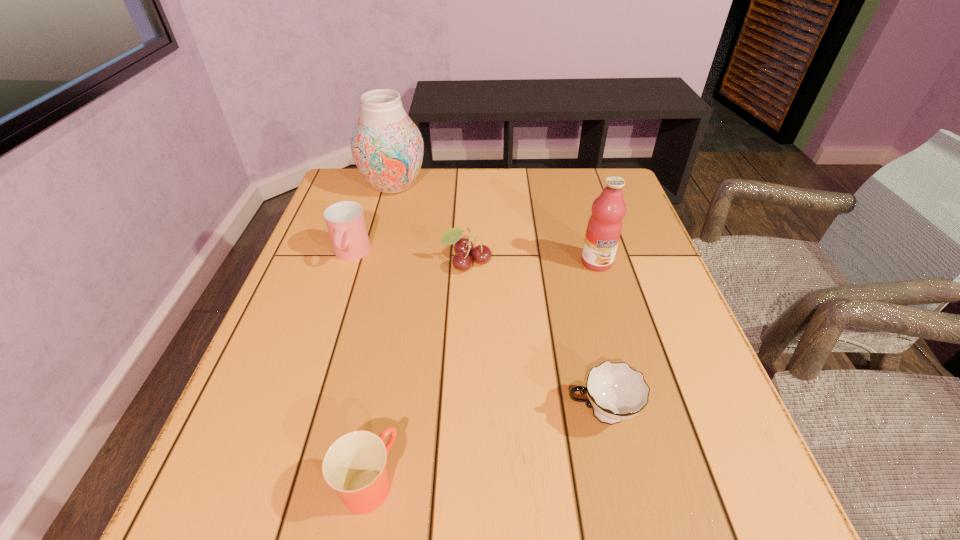
The image size is (960, 540). In order to click on vacant space positioned on the label of the second tallest object in this screenshot , I will do `click(646, 431)`.

Find the location of a particular element. vacant region located 0.360m on the side of the leftmost cup with the handle is located at coordinates (298, 415).

Locate an element on the screen. Image resolution: width=960 pixels, height=540 pixels. free space located on the leaves of the cherry is located at coordinates (463, 381).

You are a GUI agent. You are given a task and a screenshot of the screen. Output one action in this format:
    pyautogui.click(x=<x>, y=<y>)
    Task: Click on the blank space located on the right of the nearest object
    
    Given the screenshot: What is the action you would take?
    pyautogui.click(x=509, y=482)

Locate an element on the screen. Image resolution: width=960 pixels, height=540 pixels. vacant point located 0.100m on the side of the rightmost cup with the handle is located at coordinates (506, 413).

Where is `vacant space located on the side of the rightmost cup with the handle`? Image resolution: width=960 pixels, height=540 pixels. vacant space located on the side of the rightmost cup with the handle is located at coordinates (372, 413).

The height and width of the screenshot is (540, 960). I want to click on free space located on the side of the rightmost cup with the handle, so click(x=453, y=413).

Find the location of `object located in the far edge section of the desktop`. object located in the far edge section of the desktop is located at coordinates (387, 147).

You are a GUI agent. You are given a task and a screenshot of the screen. Output one action in this format:
    pyautogui.click(x=<x>, y=<y>)
    Task: Click on the object that is at the near edge
    
    Given the screenshot: What is the action you would take?
    pyautogui.click(x=354, y=465)

You are a GUI agent. You are given a task and a screenshot of the screen. Output one action in this format:
    pyautogui.click(x=<x>, y=<y>)
    Task: Click on the vase that is positioned at the left edge
    The image size is (960, 540).
    Given the screenshot: What is the action you would take?
    pyautogui.click(x=387, y=147)